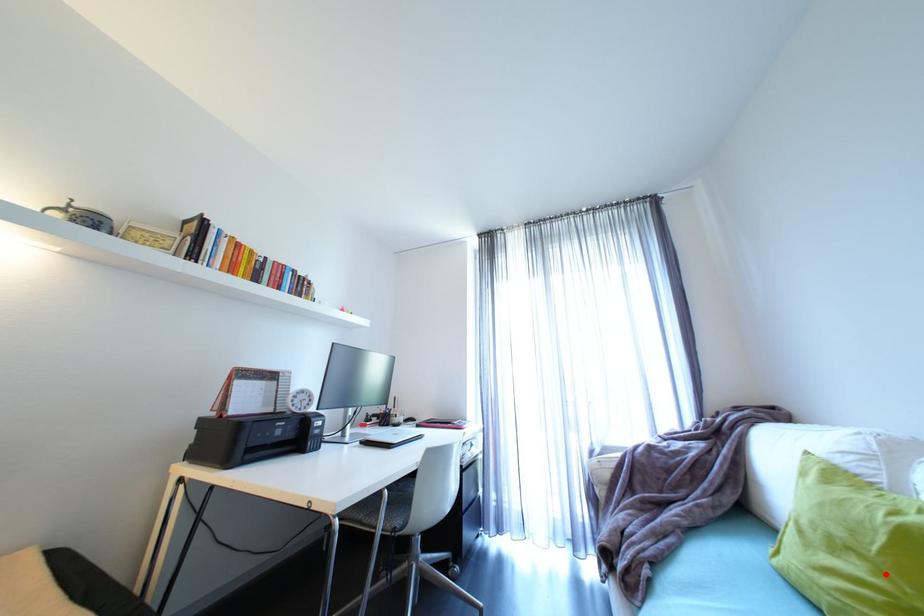
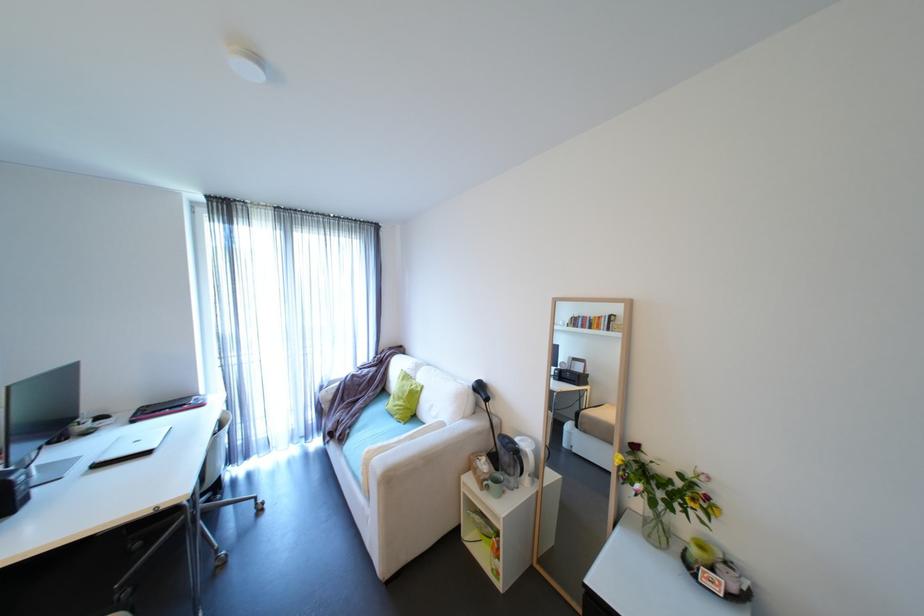
Locate, in the second image, the point that corresponds to the highlighted location in the first image.

(411, 402)